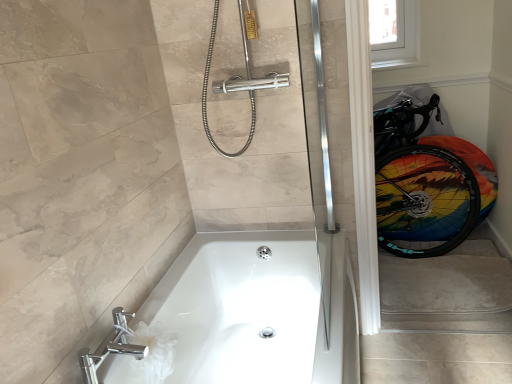
Question: Can you confirm if rainbow painted tire at right is positioned to the left of white glossy toilet paper at lower left?

Choices:
 (A) yes
 (B) no

Answer: (B)

Question: Considering the relative sizes of rainbow painted tire at right and white glossy toilet paper at lower left in the image provided, is rainbow painted tire at right thinner than white glossy toilet paper at lower left?

Choices:
 (A) no
 (B) yes

Answer: (B)

Question: Is rainbow painted tire at right positioned before white glossy toilet paper at lower left?

Choices:
 (A) yes
 (B) no

Answer: (B)

Question: From the image's perspective, is rainbow painted tire at right on white glossy toilet paper at lower left?

Choices:
 (A) yes
 (B) no

Answer: (A)

Question: Does rainbow painted tire at right appear on the right side of white glossy toilet paper at lower left?

Choices:
 (A) no
 (B) yes

Answer: (B)

Question: Is rainbow painted tire at right far away from white glossy toilet paper at lower left?

Choices:
 (A) yes
 (B) no

Answer: (A)

Question: Is transparent plastic window screen at upper right completely or partially outside of rainbow painted tire at right?

Choices:
 (A) yes
 (B) no

Answer: (A)

Question: Does transparent plastic window screen at upper right touch rainbow painted tire at right?

Choices:
 (A) no
 (B) yes

Answer: (A)

Question: Is transparent plastic window screen at upper right surrounding rainbow painted tire at right?

Choices:
 (A) yes
 (B) no

Answer: (B)

Question: Can you confirm if transparent plastic window screen at upper right is wider than rainbow painted tire at right?

Choices:
 (A) no
 (B) yes

Answer: (A)

Question: Considering the relative sizes of transparent plastic window screen at upper right and rainbow painted tire at right in the image provided, is transparent plastic window screen at upper right smaller than rainbow painted tire at right?

Choices:
 (A) yes
 (B) no

Answer: (A)

Question: Considering the relative positions of transparent plastic window screen at upper right and rainbow painted tire at right in the image provided, is transparent plastic window screen at upper right to the right of rainbow painted tire at right from the viewer's perspective?

Choices:
 (A) no
 (B) yes

Answer: (A)

Question: From the image's perspective, is white glossy bathtub at lower center below transparent plastic window screen at upper right?

Choices:
 (A) yes
 (B) no

Answer: (A)